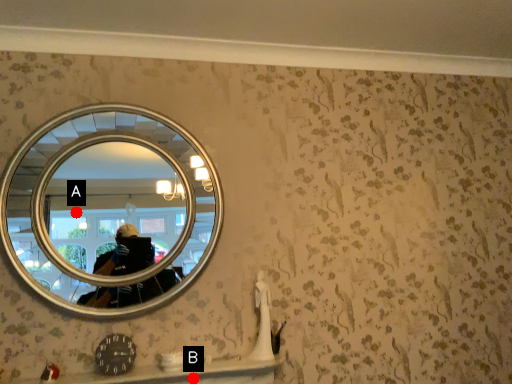
Question: Two points are circled on the image, labeled by A and B beside each circle. Among these points, which one is nearest to the camera?

Choices:
 (A) A is closer
 (B) B is closer

Answer: (B)